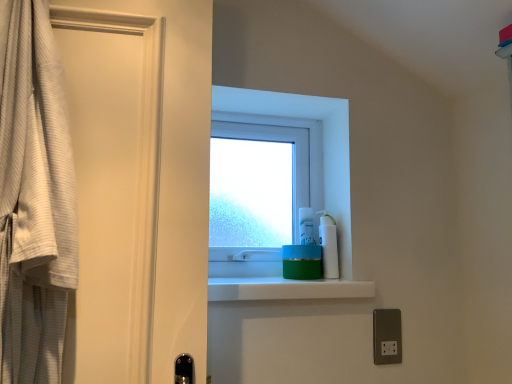
Question: Is metallic silver outlet at lower right further to the viewer compared to green matte jar at center?

Choices:
 (A) yes
 (B) no

Answer: (A)

Question: Does metallic silver outlet at lower right touch green matte jar at center?

Choices:
 (A) yes
 (B) no

Answer: (B)

Question: Is metallic silver outlet at lower right not inside green matte jar at center?

Choices:
 (A) no
 (B) yes

Answer: (B)

Question: Does metallic silver outlet at lower right have a larger size compared to green matte jar at center?

Choices:
 (A) yes
 (B) no

Answer: (B)

Question: Is metallic silver outlet at lower right to the left of green matte jar at center from the viewer's perspective?

Choices:
 (A) no
 (B) yes

Answer: (A)

Question: Is metallic silver outlet at lower right wider than green matte jar at center?

Choices:
 (A) no
 (B) yes

Answer: (A)

Question: Can you confirm if transparent plastic window at center is wider than white plastic pump bottle at upper right?

Choices:
 (A) no
 (B) yes

Answer: (B)

Question: Does transparent plastic window at center have a smaller size compared to white plastic pump bottle at upper right?

Choices:
 (A) yes
 (B) no

Answer: (B)

Question: Would you say transparent plastic window at center is outside white plastic pump bottle at upper right?

Choices:
 (A) no
 (B) yes

Answer: (B)

Question: From a real-world perspective, does transparent plastic window at center stand above white plastic pump bottle at upper right?

Choices:
 (A) yes
 (B) no

Answer: (A)

Question: Is transparent plastic window at center thinner than white plastic pump bottle at upper right?

Choices:
 (A) no
 (B) yes

Answer: (A)

Question: Can you confirm if transparent plastic window at center is shorter than white plastic pump bottle at upper right?

Choices:
 (A) no
 (B) yes

Answer: (A)

Question: Can we say white textured robe at left lies outside white plastic pump bottle at upper right?

Choices:
 (A) no
 (B) yes

Answer: (B)